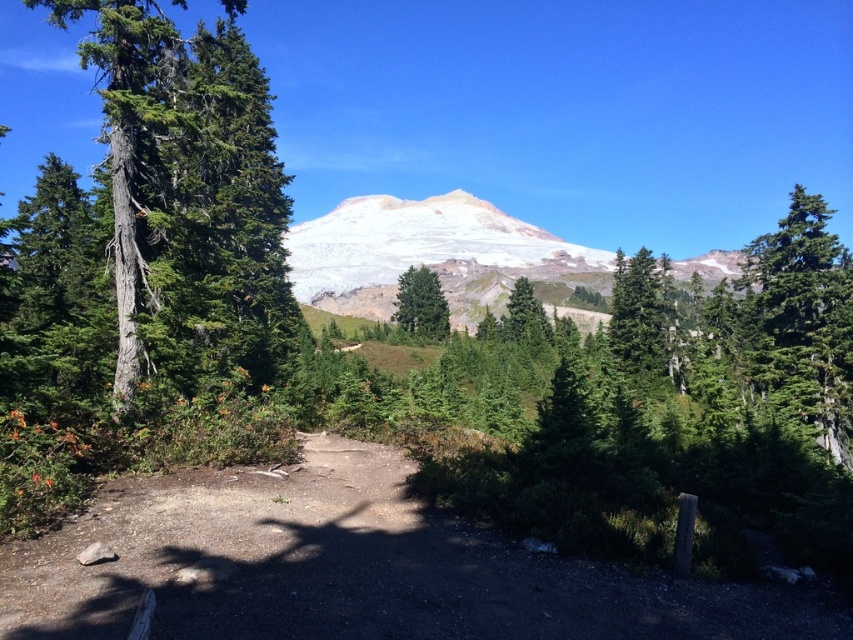
Can you confirm if gray bark tree at left is positioned above green matte tree at center?

Correct, gray bark tree at left is located above green matte tree at center.

Looking at this image, between gray bark tree at left and green matte tree at center, which one has more height?

Standing taller between the two is gray bark tree at left.

Does point (228, 186) lie behind point (437, 337)?

No, it is in front of (437, 337).

Find the location of a particular element. gray bark tree at left is located at coordinates (189, 193).

Does brown dirt track at center have a smaller size compared to gray bark tree at left?

Yes, brown dirt track at center is smaller than gray bark tree at left.

Is brown dirt track at center thinner than gray bark tree at left?

Yes, brown dirt track at center is thinner than gray bark tree at left.

Is point (173, 548) positioned behind point (254, 68)?

No, (173, 548) is in front of (254, 68).

You are a GUI agent. You are given a task and a screenshot of the screen. Output one action in this format:
    pyautogui.click(x=<x>, y=<y>)
    Task: Click on the brown dirt track at center
    This screenshot has height=640, width=853.
    Given the screenshot: What is the action you would take?
    pyautogui.click(x=352, y=570)

Which of these two, gray bark tree at left or green matte tree at upper center, stands shorter?

green matte tree at upper center

Is gray bark tree at left behind green matte tree at upper center?

No, it is in front of green matte tree at upper center.

Is point (163, 248) more distant than point (616, 307)?

That is False.

The image size is (853, 640). Identify the location of gray bark tree at left. (189, 193).